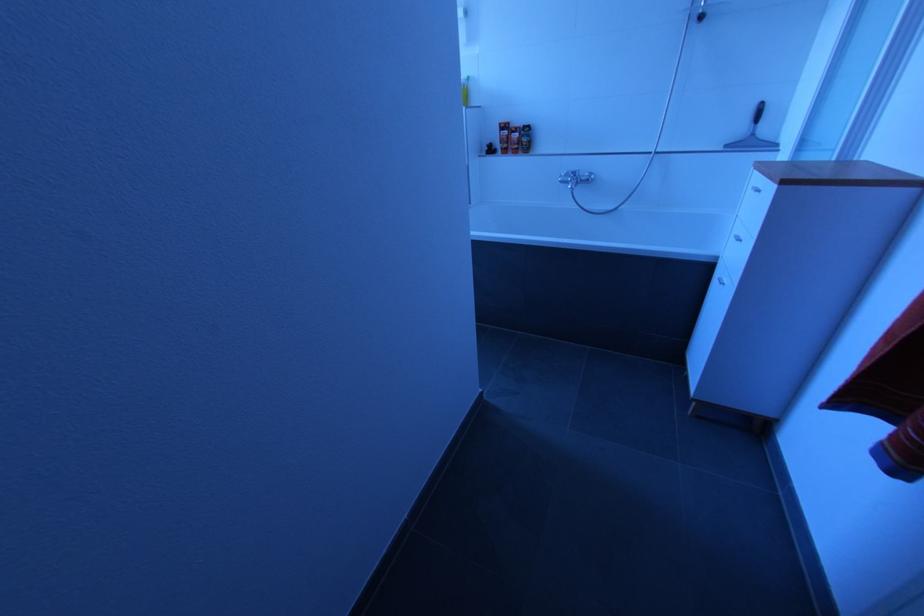
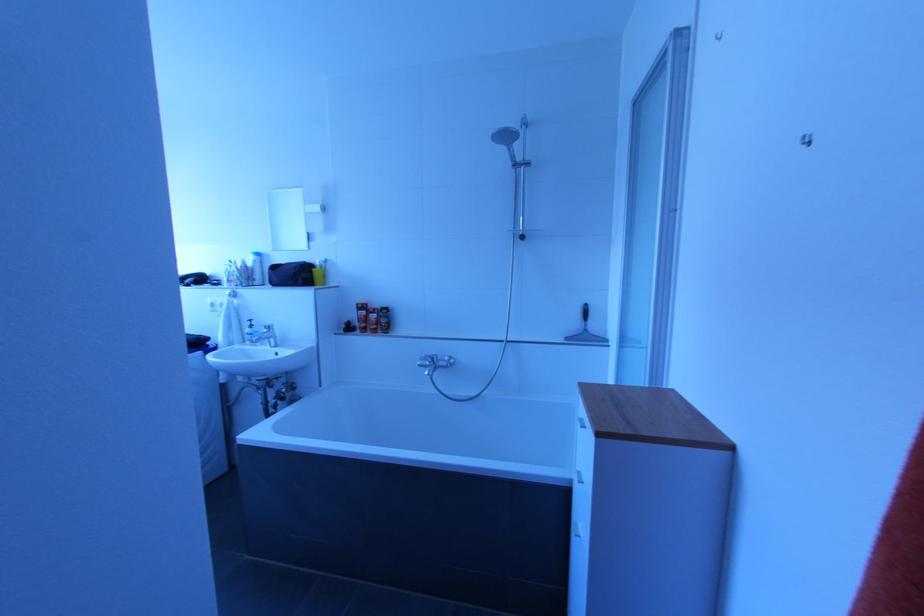
Which direction would the cameraman need to move to produce the second image?

The cameraman moved toward right, forward.